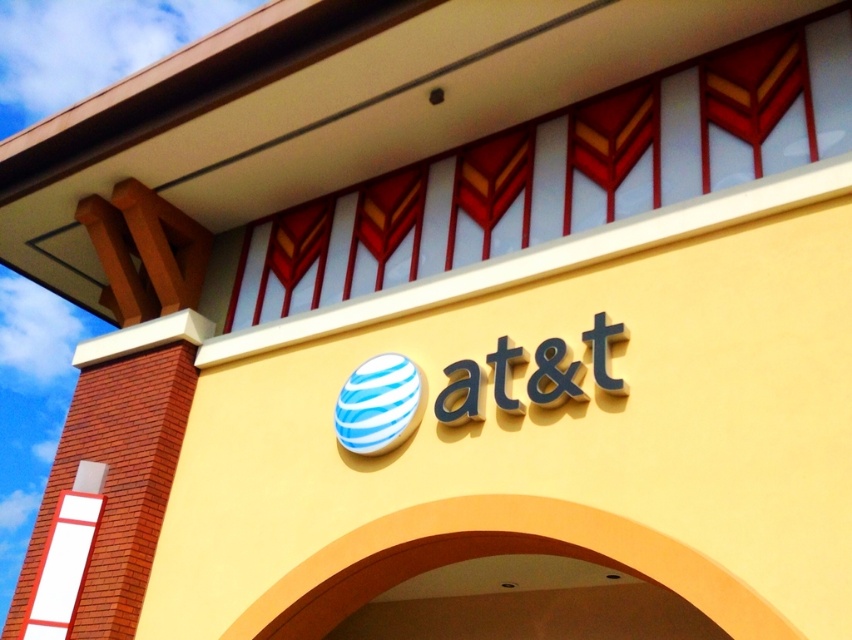
You are a delivery person standing at the entrance of the AT T store. You need to place a package that is 2 feet wide between the blue matte sign at center and the blue striped sphere at center. Is there enough space?

The distance between the blue matte sign at center and the blue striped sphere at center is 26.20 inches. Since 2 feet equals 24 inches, the space is sufficient to place the package as 26.20 inches is greater than 24 inches.

You are a customer standing at the entrance of the AT T store. You see the blue matte sign at center and the blue striped sphere at center. Which object is closer to you?

The blue matte sign at center is closer to you because it is in front of the blue striped sphere at center.